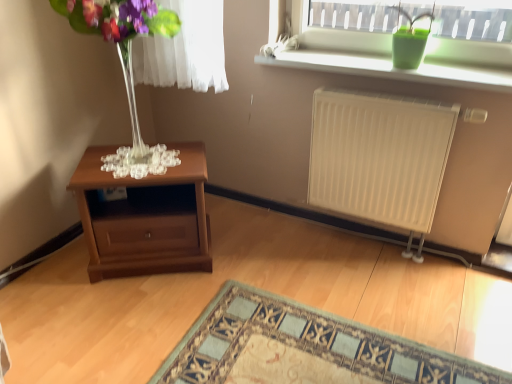
The height and width of the screenshot is (384, 512). What are the coordinates of `vacant area that lies between white matte radiator at right and mahogany wood nightstand at lower left` in the screenshot? It's located at (289, 256).